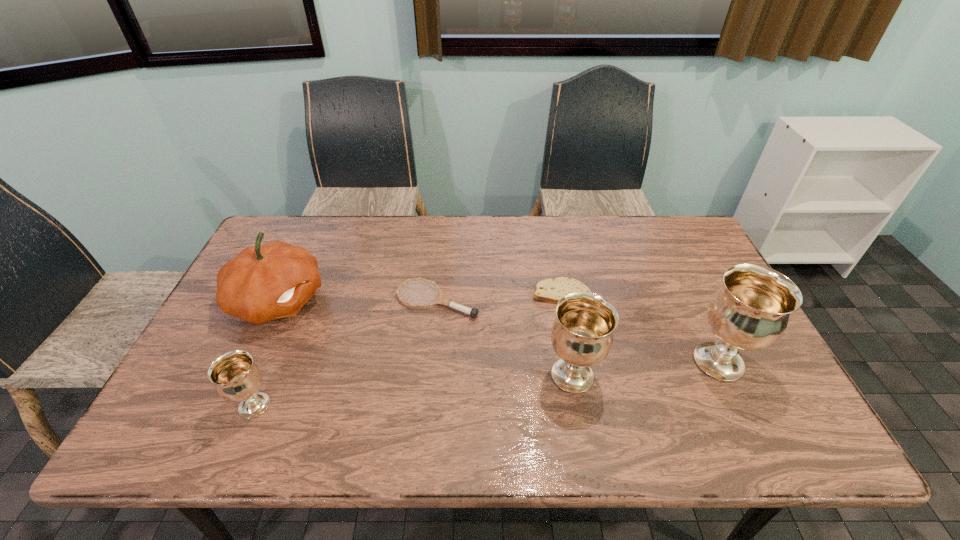
To make them evenly spaced by inserting another chalice among them, please locate a vacant spot for this new chalice. Please provide its 2D coordinates. Your answer should be formatted as a tuple, i.e. [(x, y)], where the tuple contains the x and y coordinates of a point satisfying the conditions above.

[(418, 390)]